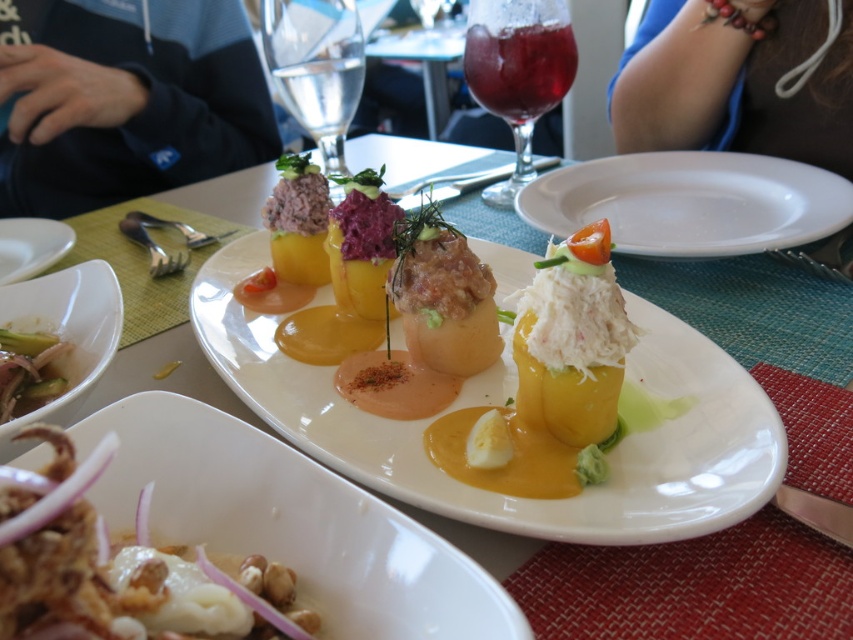
You are a server at a restaurant and need to place a dessert plate that is 12 inches wide on the table. The table has the transparent glass at upper center and the white glossy bowl at lower left. Which object should you avoid placing the dessert plate near to ensure it doesn

The transparent glass at upper center is narrower than the white glossy bowl at lower left. Since the dessert plate is 12 inches wide, you should avoid placing it near the transparent glass at upper center to ensure there is enough space.

You are a server in a restaurant and need to place a new drink order on the table. The table has a blue fabric at upper right and a translucent glass wine glass at upper center. Which object should you avoid placing the drink near to ensure it doesn

You should avoid placing the drink near the blue fabric at upper right because it is larger in size than the translucent glass wine glass at upper center, which might mean it occupies more space and could cause the drink to spill or be placed awkwardly.